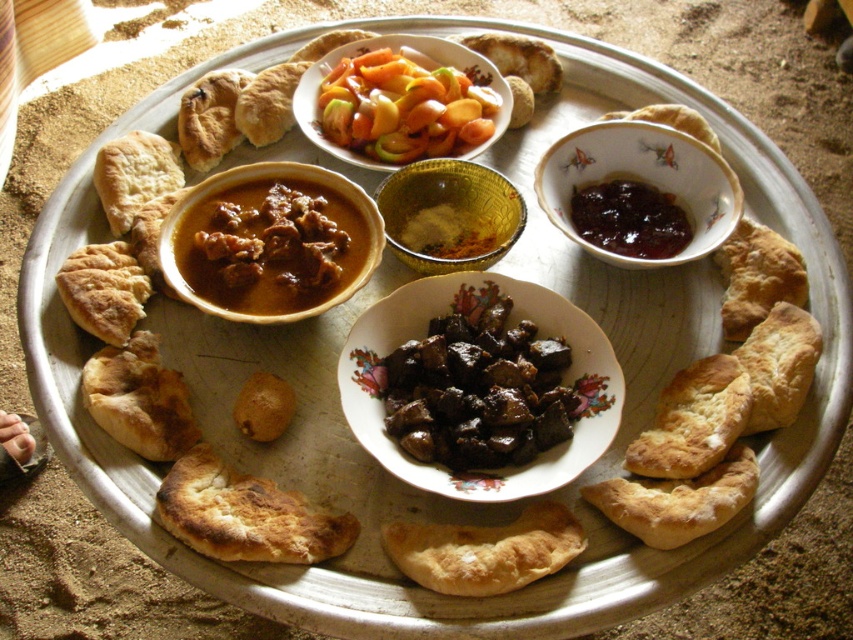
You are sitting on the sandy floor and want to reach for either the brown matte bowl at center or the brown glazed bowl at center. Which bowl can you reach first without moving your body?

The brown matte bowl at center is closer to the viewer, so you can reach it first without moving your body.

You are sitting on the floor in front of the tray and want to reach for the dark brown glossy stew at center and the brown glazed bowl at center. Which one can you grab first without moving your hand?

The dark brown glossy stew at center is closer to the viewer, so you can grab it first without moving your hand.

You are looking at the traditional meal on the large round metallic tray. Where exactly is the dark brown glossy stew at center located on the tray?

The dark brown glossy stew at center is located at point 0.606 on the x axis and 0.560 on the y axis.